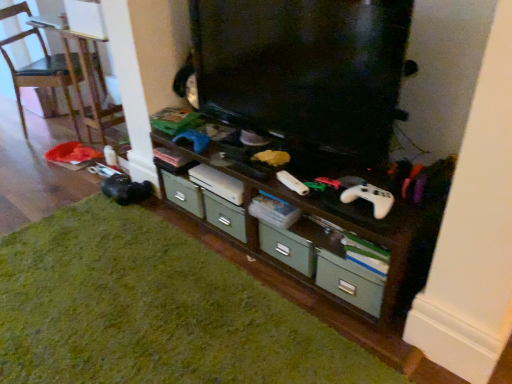
Question: Visually, is green matte hardwood at lower left positioned to the left or to the right of wooden shelf at center?

Choices:
 (A) right
 (B) left

Answer: (B)

Question: Based on their sizes in the image, would you say green matte hardwood at lower left is bigger or smaller than wooden shelf at center?

Choices:
 (A) big
 (B) small

Answer: (B)

Question: Estimate the real-world distances between objects in this image. Which object is farther from the black glossy television at center?

Choices:
 (A) wooden chair at left
 (B) green matte hardwood at lower left
 (C) white matte game controller at center
 (D) green matte drawer at lower center
 (E) wooden shelf at center

Answer: (A)

Question: Which object is positioned farthest from the black glossy television at center?

Choices:
 (A) wooden chair at left
 (B) green matte hardwood at lower left
 (C) wooden shelf at center
 (D) green matte drawer at lower center
 (E) white matte game controller at center

Answer: (A)